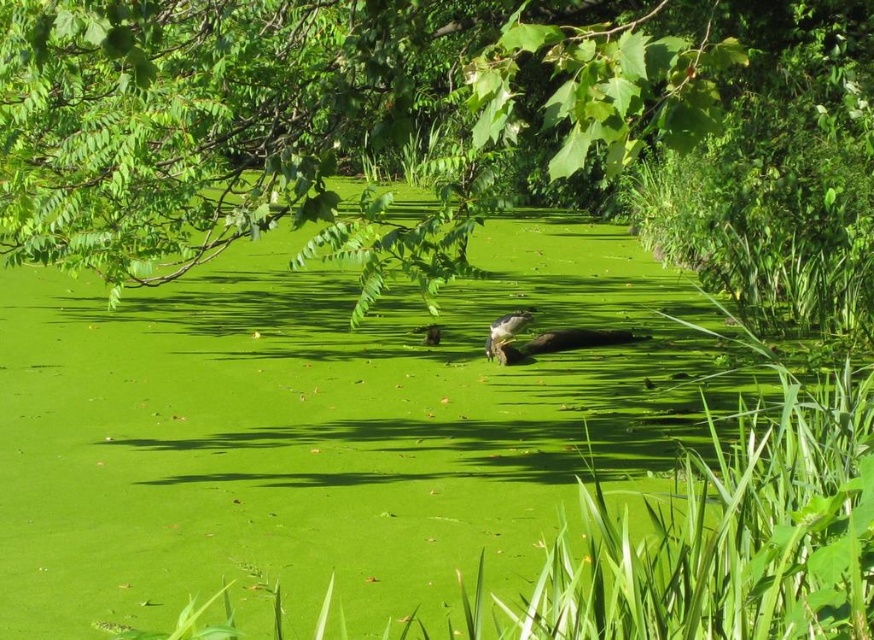
Question: Which object is farther from the camera taking this photo?

Choices:
 (A) dark brown fur at center
 (B) dark brown fur duck at center

Answer: (B)

Question: Which point is closer to the camera?

Choices:
 (A) (623, 342)
 (B) (213, 214)

Answer: (B)

Question: Does green leafy tree at center appear on the right side of brown furry bird at center?

Choices:
 (A) yes
 (B) no

Answer: (B)

Question: Which of the following is the closest to the observer?

Choices:
 (A) green leafy tree at center
 (B) brown furry bird at center

Answer: (A)

Question: Does green leafy tree at center have a lesser width compared to dark brown fur at center?

Choices:
 (A) no
 (B) yes

Answer: (A)

Question: Is dark brown fur duck at center closer to the viewer compared to brown furry bird at center?

Choices:
 (A) no
 (B) yes

Answer: (B)